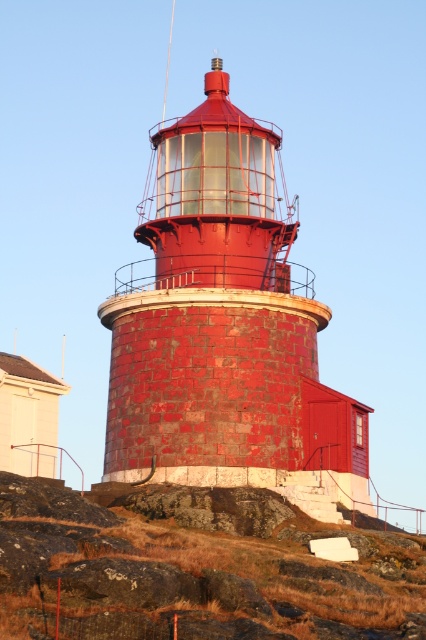
Question: Among these objects, which one is nearest to the camera?

Choices:
 (A) rusty metal lighthouse at center
 (B) brown rough rock at lower center

Answer: (B)

Question: Can you confirm if rusty metal lighthouse at center is positioned to the left of brown rough rock at lower center?

Choices:
 (A) yes
 (B) no

Answer: (A)

Question: Does rusty metal lighthouse at center lie in front of brown rough rock at lower center?

Choices:
 (A) no
 (B) yes

Answer: (A)

Question: Which point is closer to the camera?

Choices:
 (A) rusty metal lighthouse at center
 (B) brown rough rock at lower center

Answer: (B)

Question: Can you confirm if rusty metal lighthouse at center is positioned to the left of brown rough rock at lower center?

Choices:
 (A) no
 (B) yes

Answer: (B)

Question: Which point is farther to the camera?

Choices:
 (A) rusty metal lighthouse at center
 (B) brown rough rock at lower center

Answer: (A)